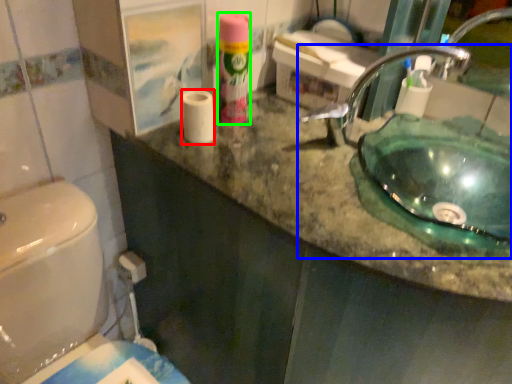
Question: Which object is positioned closest to toilet paper (highlighted by a red box)? Select from sink (highlighted by a blue box) and cleaning product (highlighted by a green box).

Choices:
 (A) sink
 (B) cleaning product

Answer: (B)